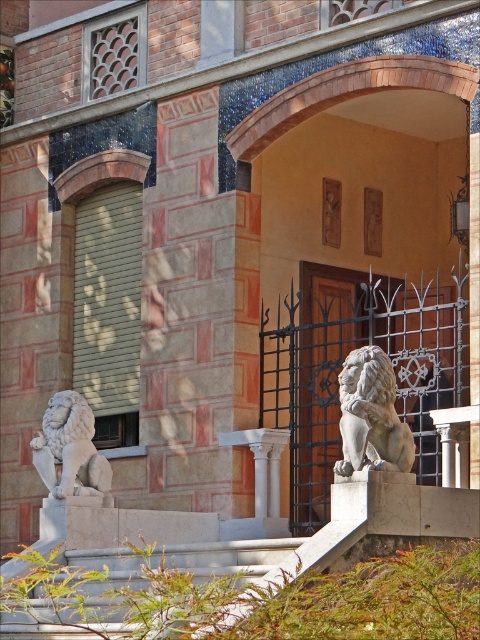
Can you confirm if matte stone lion at center is bigger than white marble lion at lower left?

Indeed, matte stone lion at center has a larger size compared to white marble lion at lower left.

Is point (362, 339) more distant than point (43, 419)?

Yes, it is behind point (43, 419).

Find the location of a particular element. The height and width of the screenshot is (640, 480). matte stone lion at center is located at coordinates tap(330, 372).

Is gray stone lion at center to the left of white marble lion at lower left from the viewer's perspective?

Incorrect, gray stone lion at center is not on the left side of white marble lion at lower left.

Between gray stone lion at center and white marble lion at lower left, which one has less height?

gray stone lion at center

Is point (351, 380) more distant than point (108, 472)?

No, it is not.

The width and height of the screenshot is (480, 640). I want to click on gray stone lion at center, so click(x=371, y=416).

Can you confirm if matte stone lion at center is shorter than gray stone lion at center?

No, matte stone lion at center is not shorter than gray stone lion at center.

Can you confirm if matte stone lion at center is smaller than gray stone lion at center?

Actually, matte stone lion at center might be larger than gray stone lion at center.

Which is in front, point (330, 442) or point (369, 468)?

Point (369, 468) is more forward.

Where is `matte stone lion at center`? The image size is (480, 640). matte stone lion at center is located at coordinates (330, 372).